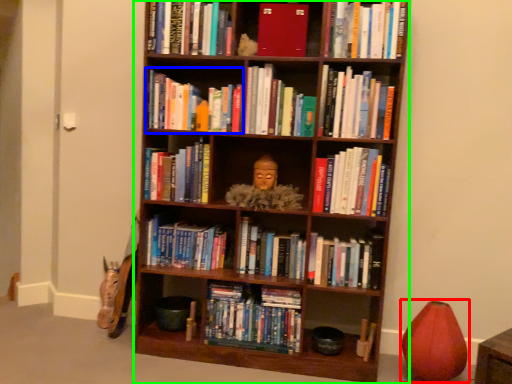
Question: Considering the real-world distances, which object is closest to toy (highlighted by a red box)? book (highlighted by a blue box) or bookcase (highlighted by a green box).

Choices:
 (A) book
 (B) bookcase

Answer: (B)